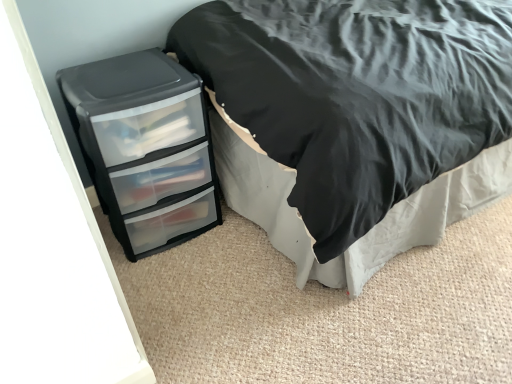
Question: Does black matte bed at left have a lesser width compared to black plastic chest of drawers at lower left?

Choices:
 (A) no
 (B) yes

Answer: (A)

Question: Considering the relative positions of black matte bed at left and black plastic chest of drawers at lower left in the image provided, is black matte bed at left behind black plastic chest of drawers at lower left?

Choices:
 (A) yes
 (B) no

Answer: (B)

Question: From the image's perspective, is black matte bed at left located above black plastic chest of drawers at lower left?

Choices:
 (A) yes
 (B) no

Answer: (A)

Question: Is black matte bed at left positioned with its back to black plastic chest of drawers at lower left?

Choices:
 (A) yes
 (B) no

Answer: (B)

Question: Considering the relative positions of black matte bed at left and black plastic chest of drawers at lower left in the image provided, is black matte bed at left to the right of black plastic chest of drawers at lower left from the viewer's perspective?

Choices:
 (A) no
 (B) yes

Answer: (B)

Question: Is black matte bed at left closer to camera compared to black plastic chest of drawers at lower left?

Choices:
 (A) yes
 (B) no

Answer: (A)

Question: Is black plastic chest of drawers at lower left aimed at black matte bed at left?

Choices:
 (A) yes
 (B) no

Answer: (B)

Question: Does black plastic chest of drawers at lower left have a lesser width compared to black matte bed at left?

Choices:
 (A) no
 (B) yes

Answer: (B)

Question: Considering the relative positions of black plastic chest of drawers at lower left and black matte bed at left in the image provided, is black plastic chest of drawers at lower left in front of black matte bed at left?

Choices:
 (A) yes
 (B) no

Answer: (B)

Question: Is black plastic chest of drawers at lower left not close to black matte bed at left?

Choices:
 (A) yes
 (B) no

Answer: (B)

Question: From the image's perspective, does black plastic chest of drawers at lower left appear higher than black matte bed at left?

Choices:
 (A) yes
 (B) no

Answer: (B)

Question: From a real-world perspective, is black plastic chest of drawers at lower left on top of black matte bed at left?

Choices:
 (A) no
 (B) yes

Answer: (A)

Question: Considering the positions of point (432, 86) and point (76, 122), is point (432, 86) closer or farther from the camera than point (76, 122)?

Choices:
 (A) farther
 (B) closer

Answer: (B)